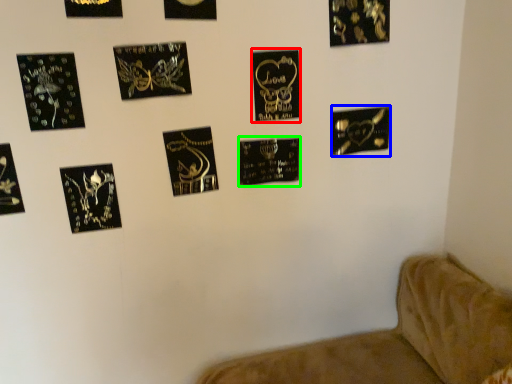
Question: Which object is the farthest from picture frame (highlighted by a red box)? Choose among these: picture frame (highlighted by a blue box) or picture frame (highlighted by a green box).

Choices:
 (A) picture frame
 (B) picture frame

Answer: (A)